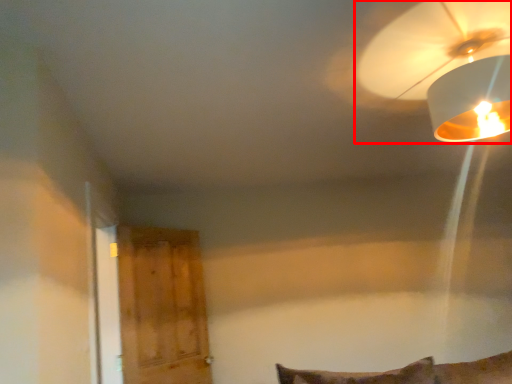
Question: Considering the relative positions of lamp (annotated by the red box) and glass door in the image provided, where is lamp (annotated by the red box) located with respect to the staircase?

Choices:
 (A) left
 (B) right

Answer: (B)